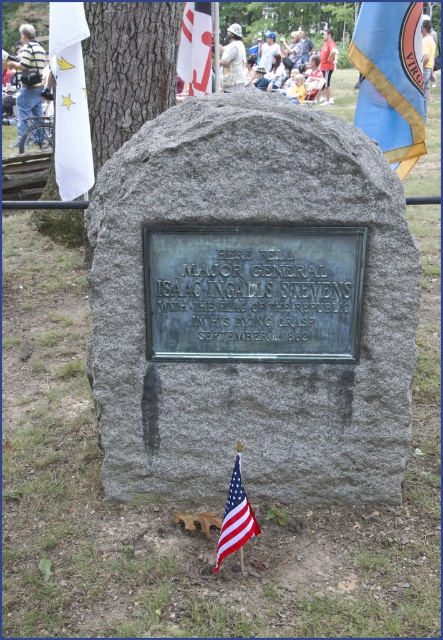
You are standing in front of the monument and want to place a new flower bouquet between the blue fabric flag at upper right and the smooth gray tree trunk at center. Based on their positions, which object should the bouquet be closer to?

The blue fabric flag at upper right is closer to the viewer than the smooth gray tree trunk at center, so the bouquet should be placed closer to the blue fabric flag at upper right to be between them.

You are standing in front of the monument and want to place a new wreath on the plaque. The wreath is too heavy to hold above your head. Which object, the blue fabric flag at upper right or the smooth gray tree trunk at center, should you lean against to stabilize yourself while placing the wreath?

You should lean against the smooth gray tree trunk at center because it is centrally located and provides better support compared to the blue fabric flag at upper right, which is a flag and not sturdy enough for support.

You are a photographer trying to capture the blue fabric flag at upper right and the smooth gray tree trunk at center in the same frame. Which object appears narrower in the photo?

The blue fabric flag at upper right appears narrower than the smooth gray tree trunk at center in the photo because it is thinner.